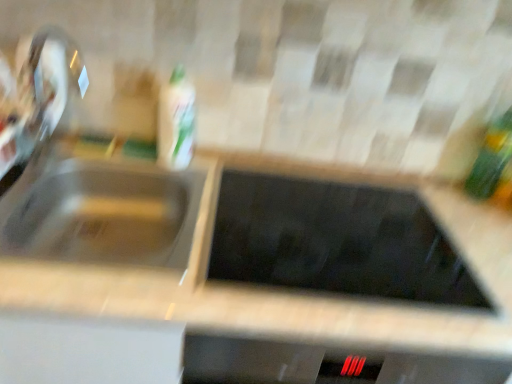
Question: From the image's perspective, is green glass bottle at right, the 1th bottle viewed from the right, above satin nickel faucet at left?

Choices:
 (A) yes
 (B) no

Answer: (B)

Question: Is green glass bottle at right, the 1th bottle viewed from the right, to the left of satin nickel faucet at left from the viewer's perspective?

Choices:
 (A) yes
 (B) no

Answer: (B)

Question: Is green glass bottle at right, the 2th bottle positioned from the left, far away from satin nickel faucet at left?

Choices:
 (A) no
 (B) yes

Answer: (B)

Question: Would you say green glass bottle at right, the 1th bottle viewed from the right, is outside satin nickel faucet at left?

Choices:
 (A) no
 (B) yes

Answer: (B)

Question: From a real-world perspective, is green glass bottle at right, the 2th bottle positioned from the left, physically above satin nickel faucet at left?

Choices:
 (A) yes
 (B) no

Answer: (B)

Question: Can you confirm if green glass bottle at right, the 1th bottle viewed from the right, is taller than satin nickel faucet at left?

Choices:
 (A) no
 (B) yes

Answer: (A)

Question: From the image's perspective, is white glossy bottle at upper center, which is the 1th bottle in left-to-right order, beneath satin silver sink at left?

Choices:
 (A) no
 (B) yes

Answer: (A)

Question: Does white glossy bottle at upper center, marked as the second bottle in a right-to-left arrangement, lie behind satin silver sink at left?

Choices:
 (A) no
 (B) yes

Answer: (B)

Question: Is white glossy bottle at upper center, which is the 1th bottle in left-to-right order, outside satin silver sink at left?

Choices:
 (A) no
 (B) yes

Answer: (B)

Question: From the image's perspective, is white glossy bottle at upper center, which is the 1th bottle in left-to-right order, located above satin silver sink at left?

Choices:
 (A) no
 (B) yes

Answer: (B)

Question: Is white glossy bottle at upper center, marked as the second bottle in a right-to-left arrangement, placed right next to satin silver sink at left?

Choices:
 (A) yes
 (B) no

Answer: (B)

Question: Is white glossy bottle at upper center, which is the 1th bottle in left-to-right order, to the left of satin silver sink at left from the viewer's perspective?

Choices:
 (A) yes
 (B) no

Answer: (B)

Question: Is green glass bottle at right, the 2th bottle positioned from the left, taller than white glossy bottle at upper center, marked as the second bottle in a right-to-left arrangement?

Choices:
 (A) no
 (B) yes

Answer: (B)